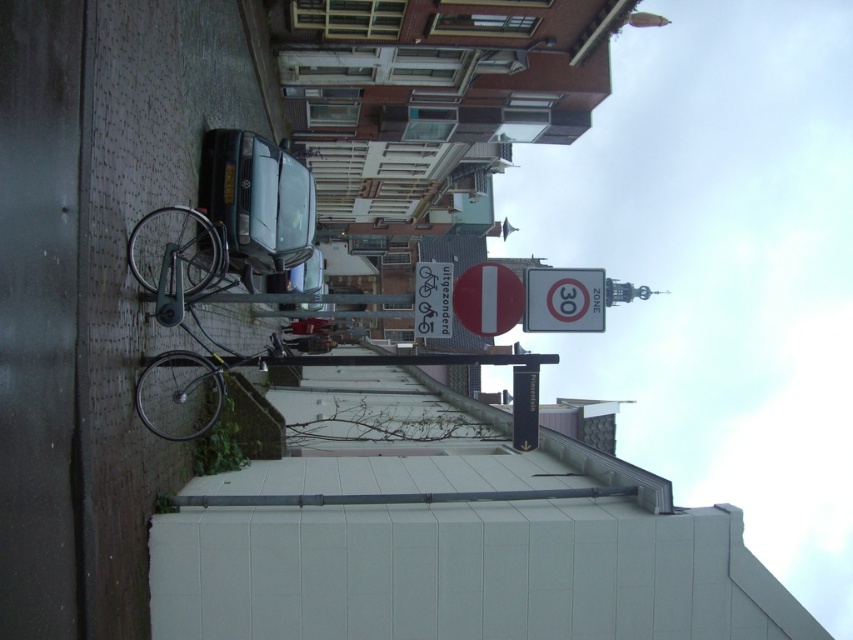
You are a delivery person trying to park your bicycle. You see the silver metallic bicycle at left and the silver metallic speed limit sign at center. According to the scene, which object is closer to the curb?

The silver metallic bicycle at left is closer to the curb because it is positioned on the left side of the silver metallic speed limit sign at center, and the curb is on the left side of the street.

You are a delivery person trying to park your bicycle. You see the silver metallic bicycle at left and the silver metallic speed limit sign at center. Which object takes up more space horizontally?

The silver metallic speed limit sign at center has a greater width than the silver metallic bicycle at left, so it takes up more horizontal space.

You are a delivery person needing to read the speed limit on the street. You see a silver metallic speed limit sign at center and a white plastic sign at center. Which sign is shorter?

The silver metallic speed limit sign at center is shorter than the white plastic sign at center.